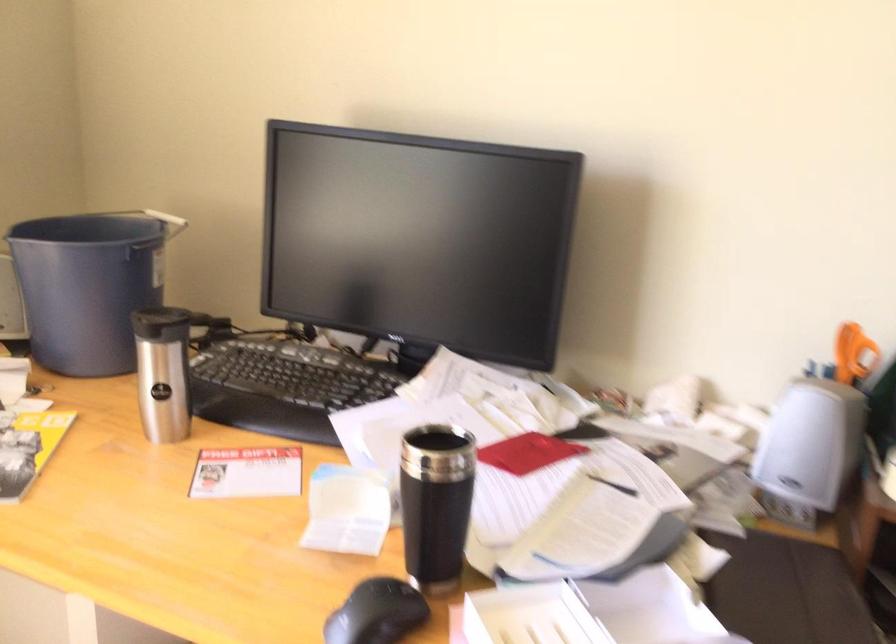
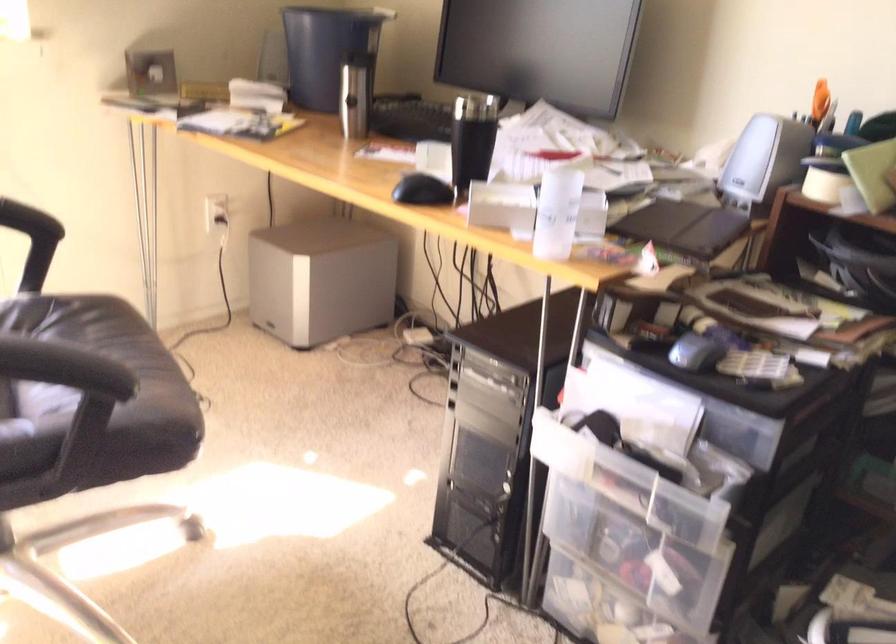
Locate, in the second image, the point that corresponds to (92,290) in the first image.

(324, 50)